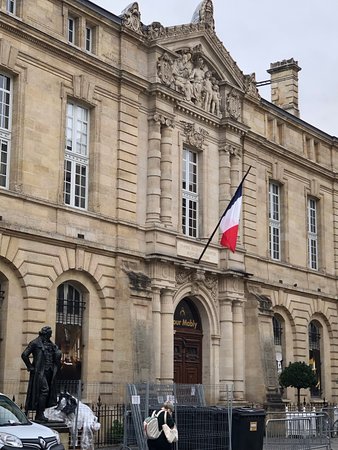
Identify the location of door. Image resolution: width=338 pixels, height=450 pixels. (185, 369).